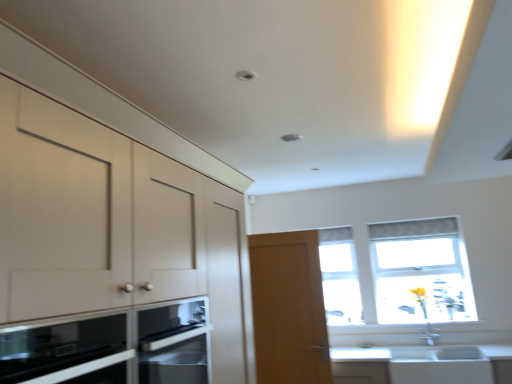
Question: From a real-world perspective, relative to light brown wooden door at center, is clear glass window at center, which ranks as the first window in left-to-right order, vertically above or below?

Choices:
 (A) above
 (B) below

Answer: (A)

Question: Looking at the image, does clear glass window at center, which ranks as the first window in left-to-right order, seem bigger or smaller compared to light brown wooden door at center?

Choices:
 (A) small
 (B) big

Answer: (A)

Question: Which object is the closest to the matte white cabinets at left?

Choices:
 (A) white glossy sink at lower right
 (B) clear glass window at center, the second window when ordered from right to left
 (C) black glass microwave oven at lower left
 (D) light brown wooden door at center
 (E) transparent glass window at upper right, marked as the 2th window in a left-to-right arrangement

Answer: (C)

Question: Which is nearer to the clear glass window at center, the second window when ordered from right to left?

Choices:
 (A) light brown wooden door at center
 (B) black glass microwave oven at lower left
 (C) matte white cabinets at left
 (D) white glossy sink at lower right
 (E) transparent glass window at upper right, marked as the 2th window in a left-to-right arrangement

Answer: (E)